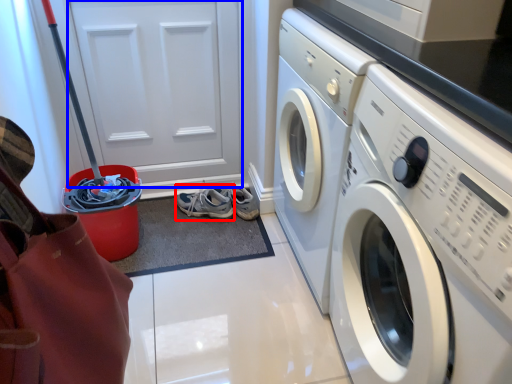
Question: Which of the following is the closest to the observer, running shoe (highlighted by a red box) or door (highlighted by a blue box)?

Choices:
 (A) running shoe
 (B) door

Answer: (B)